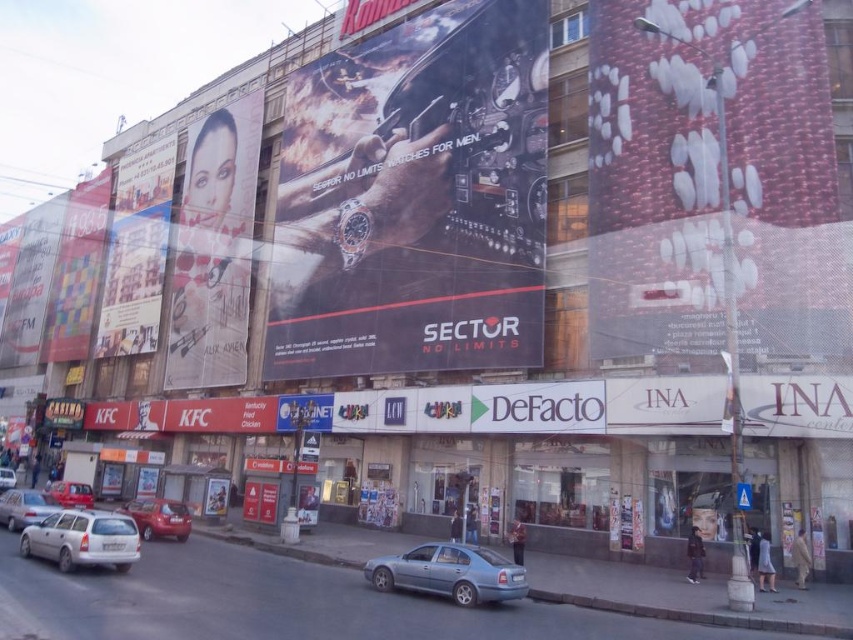
Question: Is metallic watch at center to the left of matte red banner at upper left from the viewer's perspective?

Choices:
 (A) yes
 (B) no

Answer: (B)

Question: Estimate the real-world distances between objects in this image. Which object is farther from the metallic silver sedan at lower left?

Choices:
 (A) textured red fabric at upper right
 (B) matte silver woman at left
 (C) metallic watch at center

Answer: (A)

Question: Does matte silver woman at left appear over silver metallic sedan at center?

Choices:
 (A) yes
 (B) no

Answer: (A)

Question: Which object appears farthest from the camera in this image?

Choices:
 (A) matte red banner at upper left
 (B) silver metallic hatchback at lower left
 (C) metallic watch at center
 (D) silver metallic sedan at center

Answer: (A)

Question: Is white glossy apartment building at upper left further to the viewer compared to silver metallic car at center?

Choices:
 (A) yes
 (B) no

Answer: (A)

Question: Among these objects, which one is nearest to the camera?

Choices:
 (A) matte red banner at upper left
 (B) white glossy apartment building at upper left

Answer: (B)